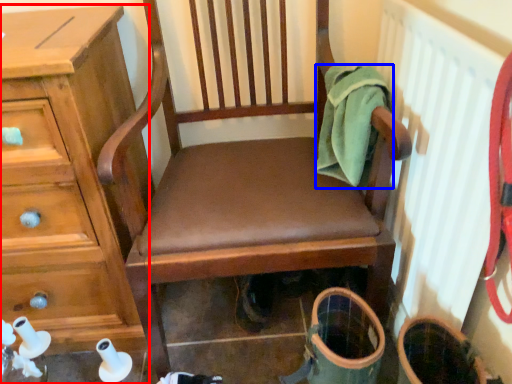
Question: Among these objects, which one is nearest to the camera, chest of drawers (highlighted by a red box) or clothing (highlighted by a blue box)?

Choices:
 (A) chest of drawers
 (B) clothing

Answer: (A)